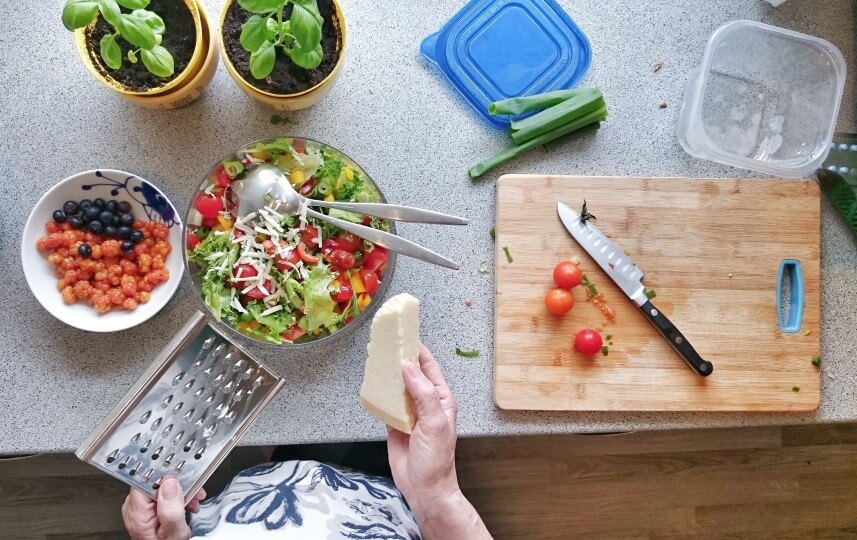
Locate an element on the screen. knife handle is located at coordinates (663, 322).